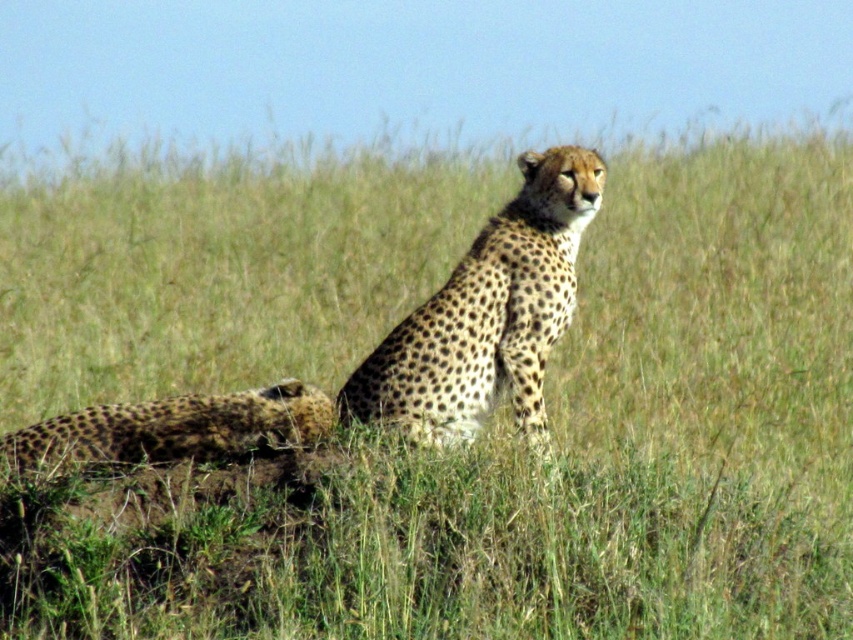
You are a wildlife photographer trying to capture a photo of both spotted fur cheetah at center and spotted fur cheetah at lower left. Based on their positions, which cheetah is located to the right of the other?

The spotted fur cheetah at center is positioned to the right of the spotted fur cheetah at lower left.

You are a wildlife photographer aiming to capture a clear photo of both spotted fur cheetah at center and spotted fur cheetah at lower left. However, the tall grass in the background might obstruct your view. Based on their positions, which cheetah is more likely to be fully visible in your photo?

The spotted fur cheetah at center is positioned over spotted fur cheetah at lower left, so the one at center will be more visible as it is in front and not as obscured by the grass.

You are a wildlife photographer trying to capture a clear shot of both spotted fur cheetah at center and spotted fur cheetah at lower left. Based on their positions, which cheetah will appear larger in your photo?

The spotted fur cheetah at center will appear larger in the photo because it is closer to the viewer than the spotted fur cheetah at lower left.